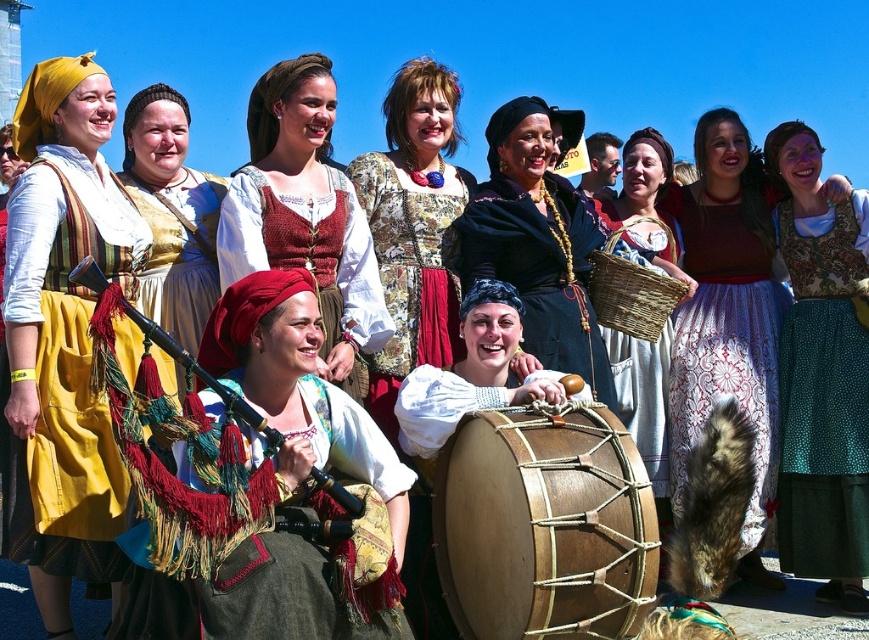
Can you confirm if knitted red vest at center is bigger than floral-patterned fabric dress at center?

Result: Incorrect, knitted red vest at center is not larger than floral-patterned fabric dress at center.

Between knitted red vest at center and floral-patterned fabric dress at center, which one appears on the left side from the viewer's perspective?

From the viewer's perspective, knitted red vest at center appears more on the left side.

Describe the element at coordinates (304, 214) in the screenshot. I see `knitted red vest at center` at that location.

Image resolution: width=869 pixels, height=640 pixels. I want to click on knitted red vest at center, so click(304, 214).

In the scene shown: Does matte yellow skirt at left appear on the right side of floral-patterned fabric dress at center?

Incorrect, matte yellow skirt at left is not on the right side of floral-patterned fabric dress at center.

Find the location of a particular element. The width and height of the screenshot is (869, 640). matte yellow skirt at left is located at coordinates (63, 332).

Who is positioned more to the right, knitted red vest at center or embroidered fabric bagpipe at center?

embroidered fabric bagpipe at center

Can you confirm if knitted red vest at center is positioned below embroidered fabric bagpipe at center?

No, knitted red vest at center is not below embroidered fabric bagpipe at center.

Is point (272, 83) less distant than point (339, 470)?

No, (272, 83) is behind (339, 470).

Locate an element on the screen. The height and width of the screenshot is (640, 869). knitted red vest at center is located at coordinates (304, 214).